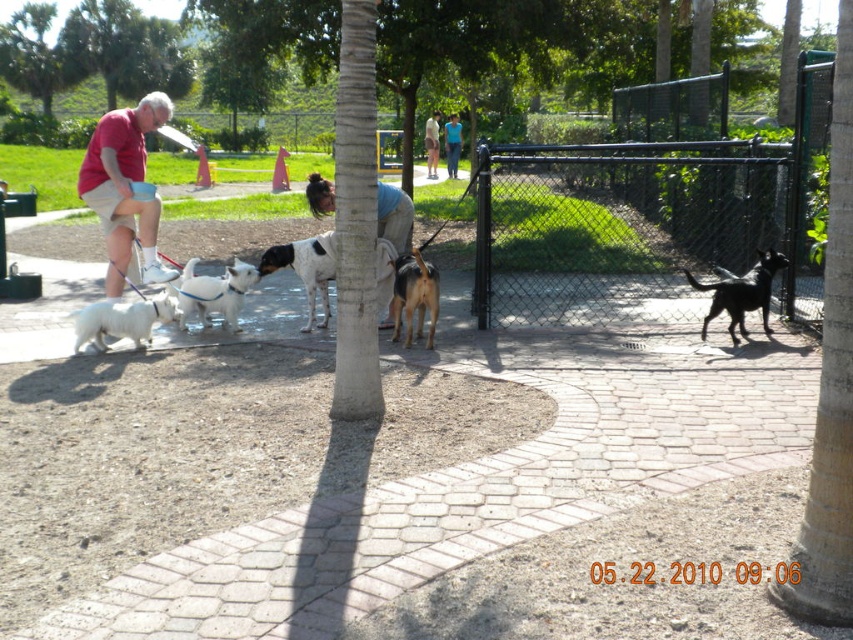
You are a photographer trying to capture a group photo of the black and white spotted dog at center and the blue fabric shirt at upper center. Which subject should you adjust your camera focus to first if you want to ensure both are in focus, considering their sizes?

The black and white spotted dog at center is wider than the blue fabric shirt at upper center, so you should focus on the black and white spotted dog at center first to ensure both fit within the frame.

You are a photographer standing at the camera position. You want to take a closeup shot of the black and white spotted dog at center. Given that your telephoto lens can focus up to 10 meters, will you be able to capture a clear closeup?

The black and white spotted dog at center is 8.03 meters away from the camera. Since the telephoto lens can focus up to 10 meters, you can capture a clear closeup.